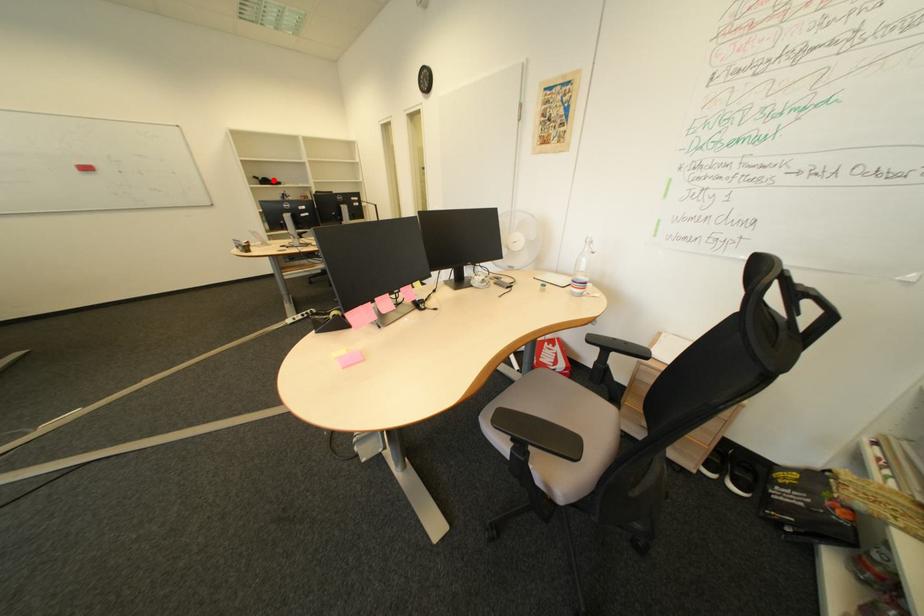
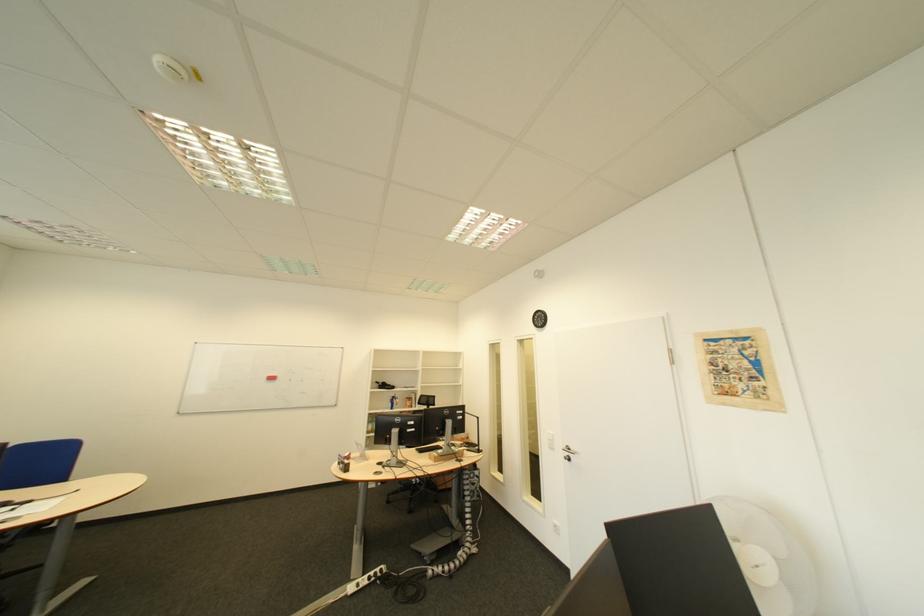
In the second image, find the point that corresponds to the highlighted location in the first image.

(393, 385)